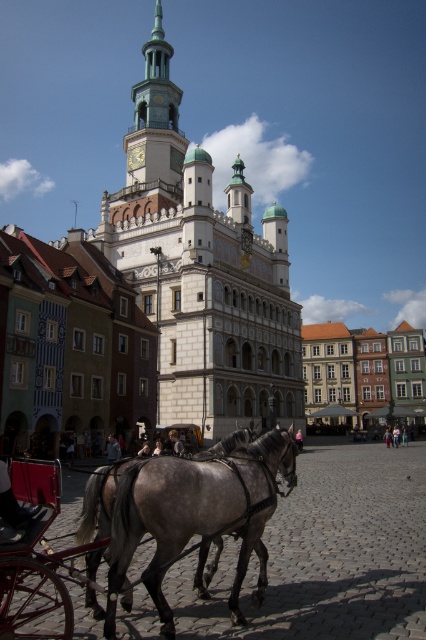
Who is positioned more to the right, white stone tower at center or matte orange building at right?

Positioned to the right is matte orange building at right.

Is white stone tower at center wider than matte orange building at right?

Correct, the width of white stone tower at center exceeds that of matte orange building at right.

Which is in front, point (181, 196) or point (314, 394)?

Point (181, 196) is in front.

This screenshot has width=426, height=640. In order to click on white stone tower at center in this screenshot , I will do `click(201, 269)`.

Is gray matte horse at center bigger than light brown leather jacket at center?

Yes.

Is point (120, 589) positioned behind point (175, 451)?

That is False.

Find the location of a particular element. gray matte horse at center is located at coordinates (196, 515).

Is matte orange building at right wider than light blue fabric at center?

Indeed, matte orange building at right has a greater width compared to light blue fabric at center.

Does point (379, 388) come behind point (108, 456)?

Yes, it is.

Locate an element on the screen. The height and width of the screenshot is (640, 426). matte orange building at right is located at coordinates (362, 371).